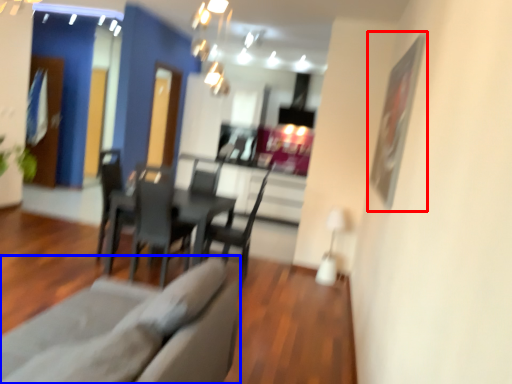
Question: Which object appears farthest to the camera in this image, picture frame (highlighted by a red box) or couch (highlighted by a blue box)?

Choices:
 (A) picture frame
 (B) couch

Answer: (A)